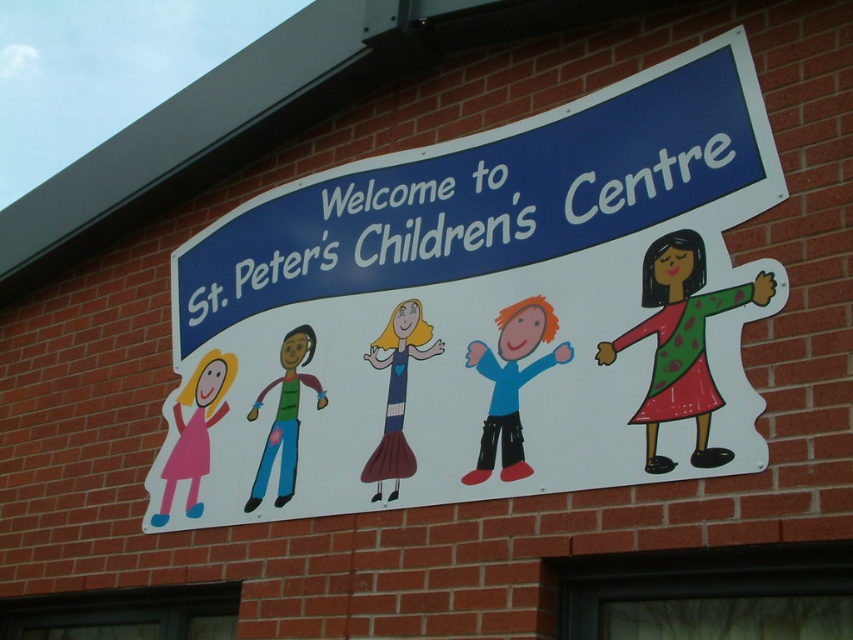
Does white paper sign at center appear under green dotted dress at center?

No, white paper sign at center is not below green dotted dress at center.

Measure the distance from white paper sign at center to green dotted dress at center.

white paper sign at center and green dotted dress at center are 79.55 centimeters apart.

Describe the element at coordinates (497, 305) in the screenshot. I see `white paper sign at center` at that location.

You are a GUI agent. You are given a task and a screenshot of the screen. Output one action in this format:
    pyautogui.click(x=<x>, y=<y>)
    Task: Click on the white paper sign at center
    The height and width of the screenshot is (640, 853).
    Given the screenshot: What is the action you would take?
    pyautogui.click(x=497, y=305)

This screenshot has height=640, width=853. Describe the element at coordinates (682, 342) in the screenshot. I see `green dotted dress at center` at that location.

Image resolution: width=853 pixels, height=640 pixels. What are the coordinates of `green dotted dress at center` in the screenshot? It's located at (682, 342).

Is point (708, 300) in front of point (404, 440)?

Yes.

You are a GUI agent. You are given a task and a screenshot of the screen. Output one action in this format:
    pyautogui.click(x=<x>, y=<y>)
    Task: Click on the green dotted dress at center
    
    Given the screenshot: What is the action you would take?
    pyautogui.click(x=682, y=342)

Which is in front, point (674, 289) or point (173, 483)?

Point (674, 289)

Can you confirm if green dotted dress at center is positioned below matte pink dress at left?

Actually, green dotted dress at center is above matte pink dress at left.

This screenshot has height=640, width=853. I want to click on green dotted dress at center, so click(682, 342).